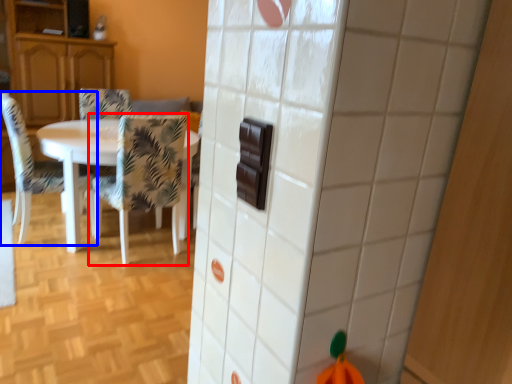
Question: Among these objects, which one is nearest to the camera, chair (highlighted by a red box) or chair (highlighted by a blue box)?

Choices:
 (A) chair
 (B) chair

Answer: (A)